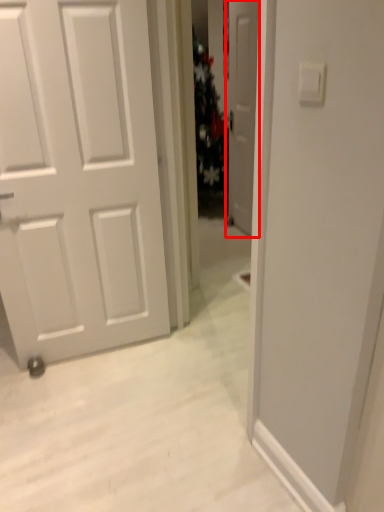
Question: In this image, where is door (annotated by the red box) located relative to light switch?

Choices:
 (A) right
 (B) left

Answer: (A)